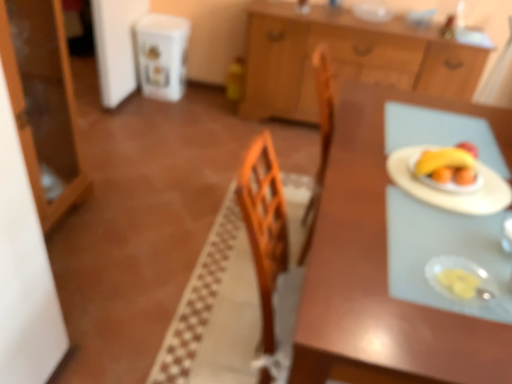
Image resolution: width=512 pixels, height=384 pixels. What are the coordinates of `free space between translucent plastic plate at right, placed as the first tableware when sorted from bottom to top, and yellow matte bananas at right` in the screenshot? It's located at (447, 219).